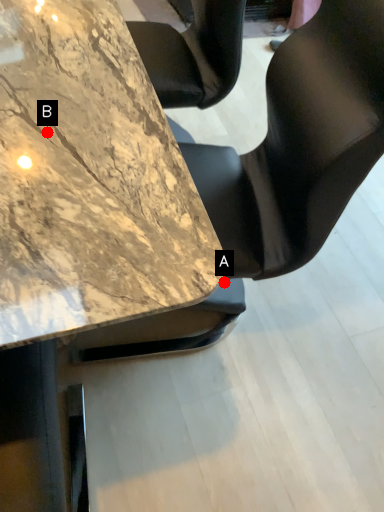
Question: Two points are circled on the image, labeled by A and B beside each circle. Which point is further to the camera?

Choices:
 (A) A is further
 (B) B is further

Answer: (A)